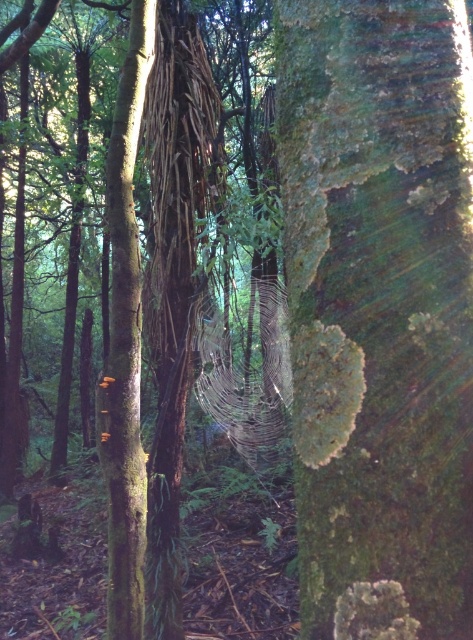
You are a bird looking for a place to perch. You see the green rough bark tree at center and the smooth brown tree trunk at left. Which tree would you choose if you want to land on a higher branch?

The smooth brown tree trunk at left is higher than the green rough bark tree at center, so you should choose the smooth brown tree trunk at left to land on a higher branch.

You are a hiker who wants to take a photo of the green rough bark tree at center and the smooth brown tree trunk at left. Based on their positions, which tree should you focus on first if you are moving from left to right across the forest path?

The smooth brown tree trunk at left should be focused on first since it is positioned to the left of the green rough bark tree at center when moving from left to right.

You are standing in the forest and want to touch the green rough bark tree at center. Which direction should you move from your current position at point (379, 310) to reach it?

You are already at the location of the green rough bark tree at center, as it is located at point (379, 310).